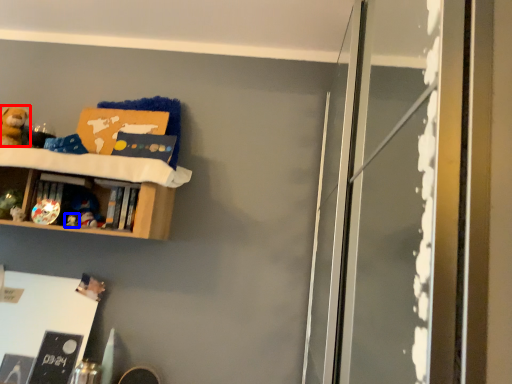
Question: Which point is closer to the camera, toy (highlighted by a red box) or toy (highlighted by a blue box)?

Choices:
 (A) toy
 (B) toy

Answer: (A)